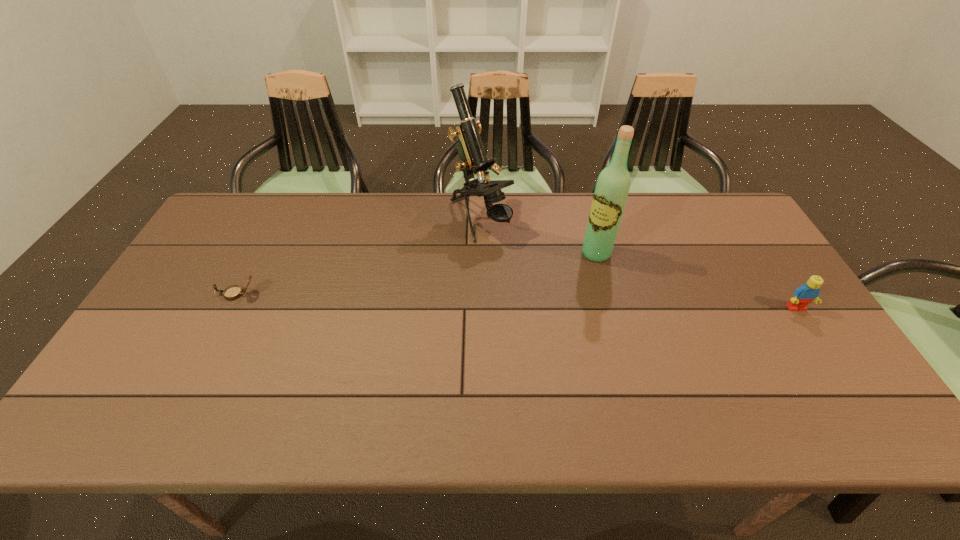
Identify the location of free space on the desktop that is between the compass and the rightmost object and is positioned on the front-facing side of the wine bottle. (545, 302).

Where is `vacant space on the desktop that is between the leftmost object and the rightmost object and is positioned through the eyepiece of the third object from right to left`? vacant space on the desktop that is between the leftmost object and the rightmost object and is positioned through the eyepiece of the third object from right to left is located at coordinates (565, 302).